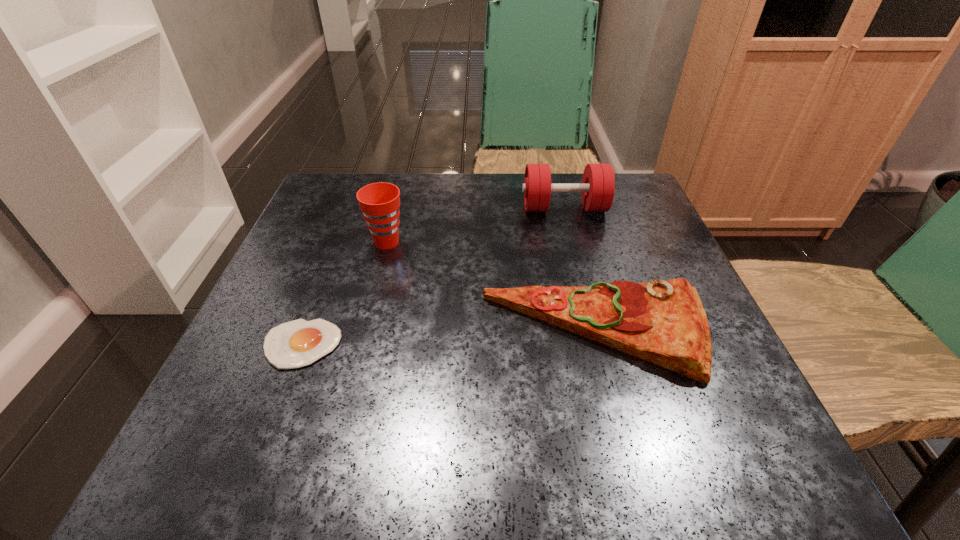
The width and height of the screenshot is (960, 540). Identify the location of free space at the far left corner. (349, 223).

Find the location of a particular element. Image resolution: width=960 pixels, height=540 pixels. vacant space at the near left corner is located at coordinates (220, 480).

This screenshot has height=540, width=960. I want to click on vacant space at the near right corner of the desktop, so click(x=658, y=417).

You are a GUI agent. You are given a task and a screenshot of the screen. Output one action in this format:
    pyautogui.click(x=<x>, y=<y>)
    Task: Click on the unoccupied area between the egg yolk and the cup
    
    Given the screenshot: What is the action you would take?
    pyautogui.click(x=344, y=293)

This screenshot has height=540, width=960. I want to click on vacant region between the third tallest object and the farthest object, so click(581, 271).

I want to click on free space between the egg yolk and the farthest object, so click(433, 276).

I want to click on empty location between the pizza and the second farthest object, so click(492, 287).

Locate an element on the screen. vacant area between the farthest object and the cup is located at coordinates (475, 225).

Identify the location of vacant area that lies between the farthest object and the second farthest object. The height and width of the screenshot is (540, 960). (475, 225).

Find the location of `free space between the shortest object and the dumbbell`. free space between the shortest object and the dumbbell is located at coordinates (433, 276).